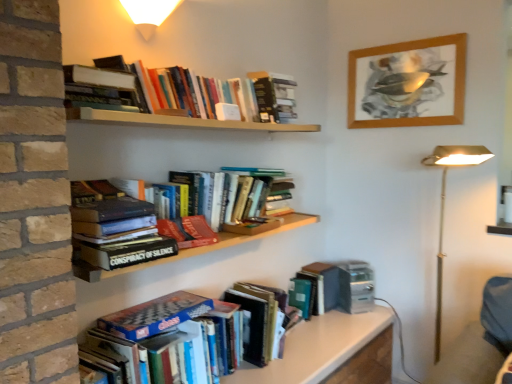
Identify the location of free space above wooden picture frame at upper right (from a real-world perspective). The width and height of the screenshot is (512, 384). (405, 41).